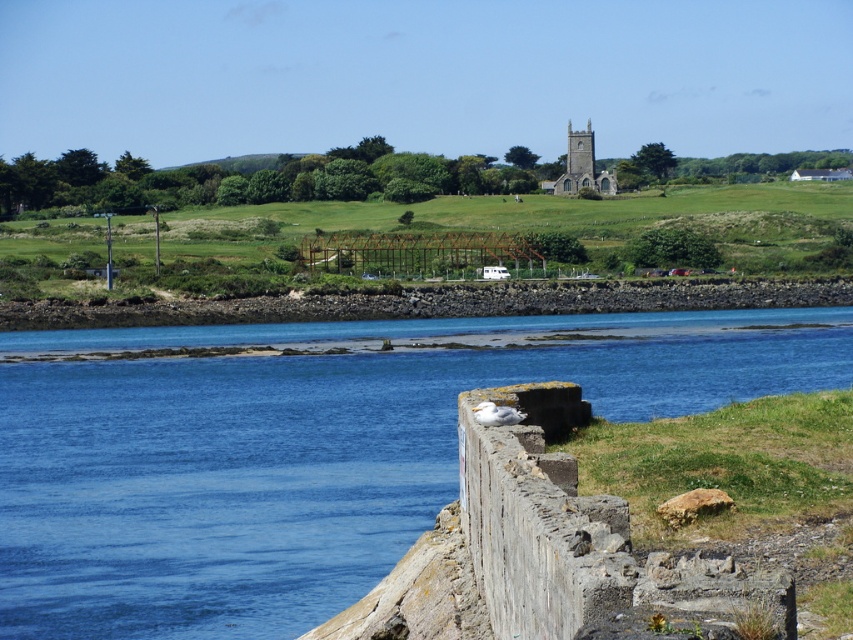
Question: Which object is farther from the camera taking this photo?

Choices:
 (A) blue water at center
 (B) stone church steeple at upper center

Answer: (B)

Question: Does blue water at center lie in front of stone church steeple at upper center?

Choices:
 (A) no
 (B) yes

Answer: (B)

Question: Can you confirm if blue water at center is smaller than stone church steeple at upper center?

Choices:
 (A) no
 (B) yes

Answer: (A)

Question: Does blue water at center lie in front of stone church steeple at upper center?

Choices:
 (A) no
 (B) yes

Answer: (B)